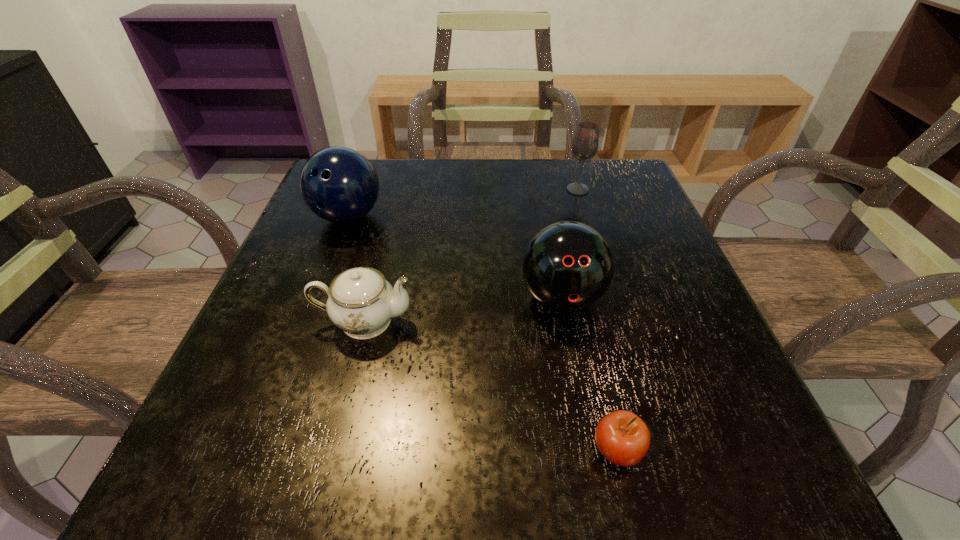
Image resolution: width=960 pixels, height=540 pixels. Identify the location of object that is at the far right corner. (585, 143).

Locate an element on the screen. The height and width of the screenshot is (540, 960). free space at the far edge of the desktop is located at coordinates (492, 208).

In the image, there is a desktop. At what (x,y) coordinates should I click in order to perform the action: click on vacant area at the near edge. Please return your answer as a coordinate pair (x, y). Image resolution: width=960 pixels, height=540 pixels. Looking at the image, I should click on (592, 427).

Image resolution: width=960 pixels, height=540 pixels. In the image, there is a desktop. Find the location of `free region at the left edge`. free region at the left edge is located at coordinates (335, 226).

Locate an element on the screen. The height and width of the screenshot is (540, 960). free space at the right edge is located at coordinates (658, 266).

Identify the location of vacant space at the near left corner of the desktop. This screenshot has height=540, width=960. (271, 443).

This screenshot has width=960, height=540. In the image, there is a desktop. Identify the location of vacant space at the far right corner. (614, 183).

Find the location of a particular element. free space at the near right corner of the desktop is located at coordinates (728, 473).

What are the coordinates of `vacant point located between the shortest object and the farthest object` in the screenshot? It's located at (597, 320).

Where is `blank region between the fourth nearest object and the nearer bowling ball`? blank region between the fourth nearest object and the nearer bowling ball is located at coordinates (455, 257).